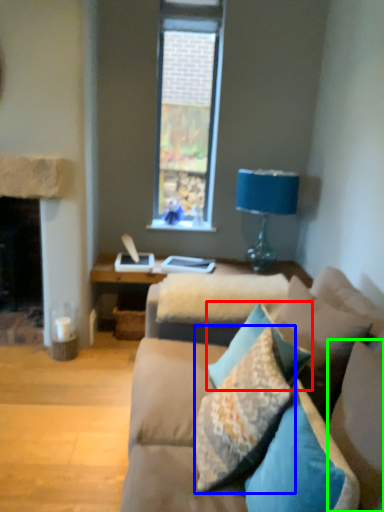
Question: Which object is the closest to the pillow (highlighted by a red box)? Choose among these: pillow (highlighted by a blue box) or pillow (highlighted by a green box).

Choices:
 (A) pillow
 (B) pillow

Answer: (A)